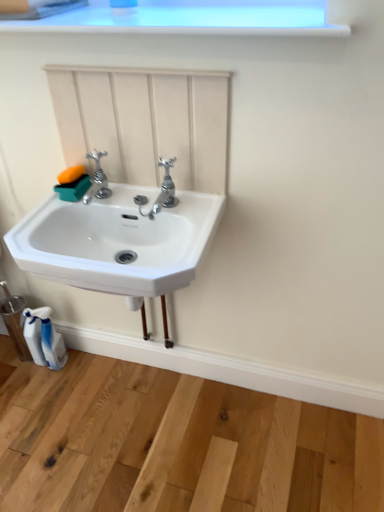
Question: Does white plastic spray bottle at lower left come behind polished chrome faucet at center, which appears as the 2th tap when viewed from the left?

Choices:
 (A) yes
 (B) no

Answer: (A)

Question: Is white plastic spray bottle at lower left closer to camera compared to polished chrome faucet at center, the first tap positioned from the right?

Choices:
 (A) yes
 (B) no

Answer: (B)

Question: From a real-world perspective, is white plastic spray bottle at lower left positioned under polished chrome faucet at center, which appears as the 2th tap when viewed from the left, based on gravity?

Choices:
 (A) no
 (B) yes

Answer: (B)

Question: Is white plastic spray bottle at lower left to the left of polished chrome faucet at center, the first tap positioned from the right, from the viewer's perspective?

Choices:
 (A) yes
 (B) no

Answer: (A)

Question: From the image's perspective, is white plastic spray bottle at lower left below polished chrome faucet at center, which appears as the 2th tap when viewed from the left?

Choices:
 (A) yes
 (B) no

Answer: (A)

Question: Could polished chrome faucet at center, the first tap positioned from the right, be considered to be inside white plastic spray bottle at lower left?

Choices:
 (A) no
 (B) yes

Answer: (A)

Question: From the image's perspective, is polished chrome faucet at center, the first tap positioned from the right, above white plastic spray bottle at lower left?

Choices:
 (A) yes
 (B) no

Answer: (A)

Question: Is polished chrome faucet at center, which appears as the 2th tap when viewed from the left, located outside white plastic spray bottle at lower left?

Choices:
 (A) no
 (B) yes

Answer: (B)

Question: Is polished chrome faucet at center, the first tap positioned from the right, in contact with white plastic spray bottle at lower left?

Choices:
 (A) no
 (B) yes

Answer: (A)

Question: From a real-world perspective, is polished chrome faucet at center, the first tap positioned from the right, located higher than white plastic spray bottle at lower left?

Choices:
 (A) no
 (B) yes

Answer: (B)

Question: Is polished chrome faucet at center, which appears as the 2th tap when viewed from the left, closer to camera compared to white plastic spray bottle at lower left?

Choices:
 (A) no
 (B) yes

Answer: (B)

Question: Can you confirm if polished chrome faucet at center, the first tap positioned from the right, is shorter than white plastic spray bottle at lower left?

Choices:
 (A) yes
 (B) no

Answer: (A)

Question: From the image's perspective, is polished chrome faucet at center, the first tap positioned from the right, beneath white ceramic sink at center?

Choices:
 (A) no
 (B) yes

Answer: (A)